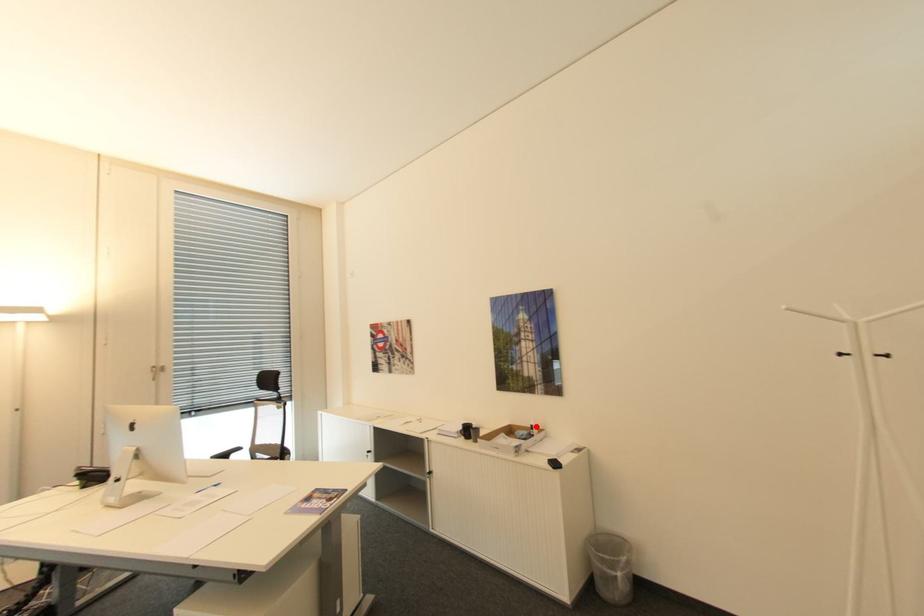
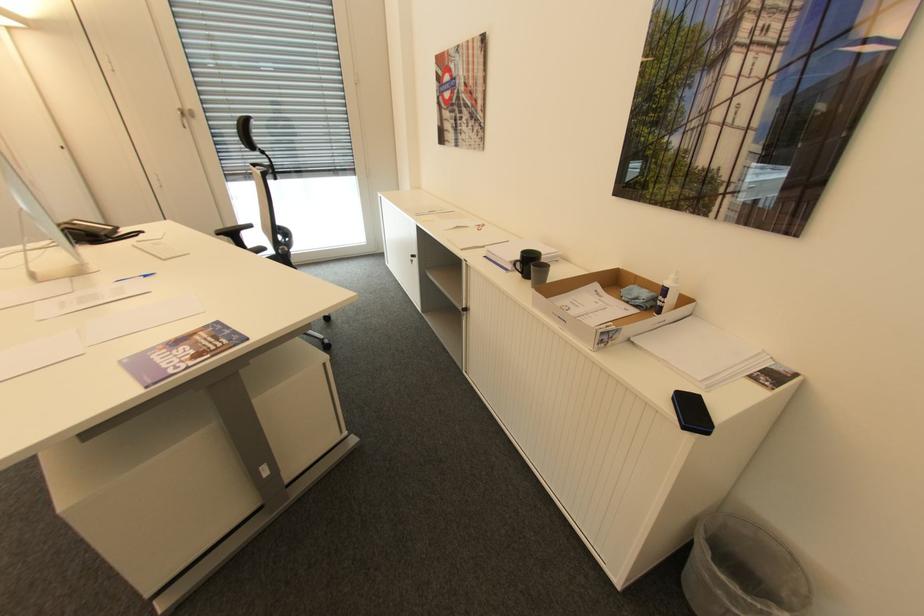
Where in the second image is the point corresponding to the highlighted location from the first image?

(670, 291)